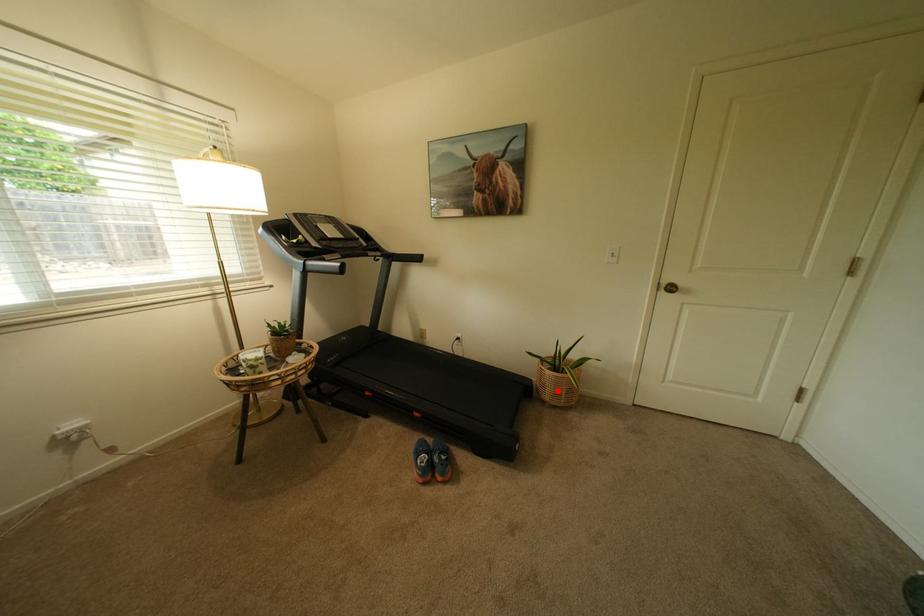
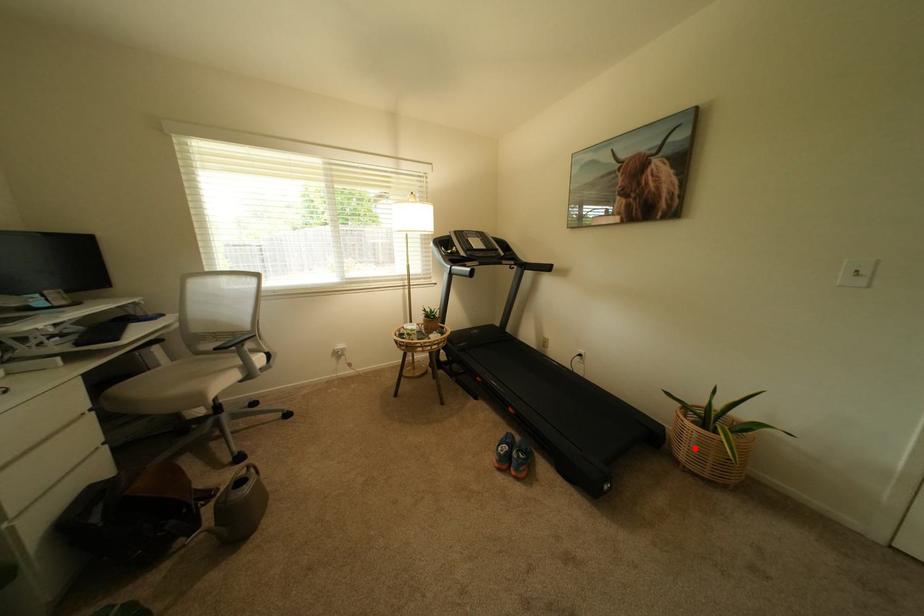
I am providing you with two images of the same scene from different viewpoints. A red point is marked on the first image and another point is marked on the second image. Does the point marked in image1 correspond to the same location as the one in image2?

Yes